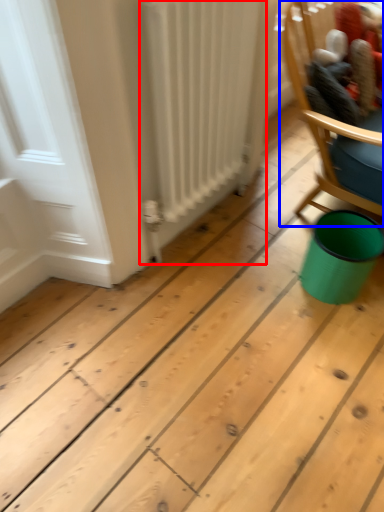
Question: Which point is closer to the camera, radiator (highlighted by a red box) or chair (highlighted by a blue box)?

Choices:
 (A) radiator
 (B) chair

Answer: (A)